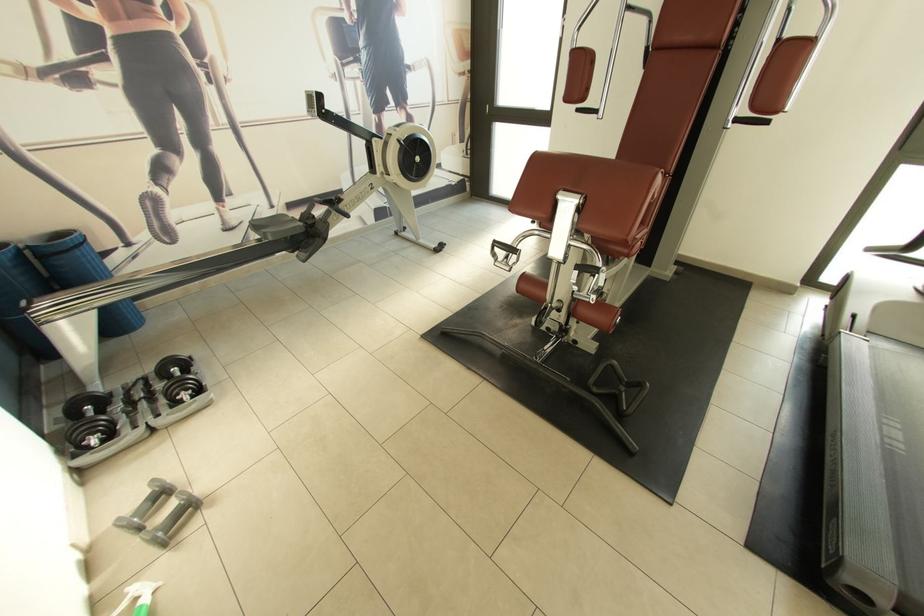
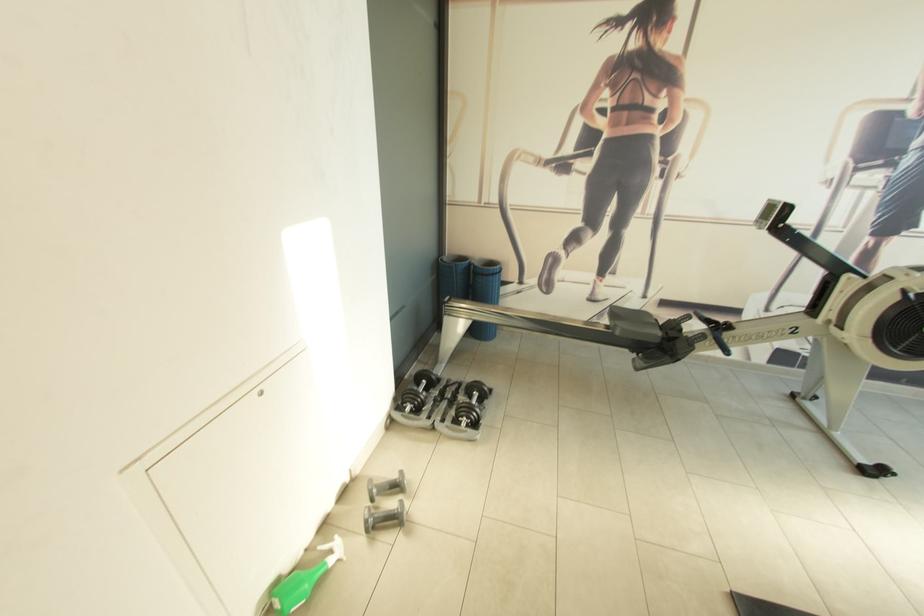
Find the pixel in the second image that matches pixel 107 424 in the first image.

(424, 402)